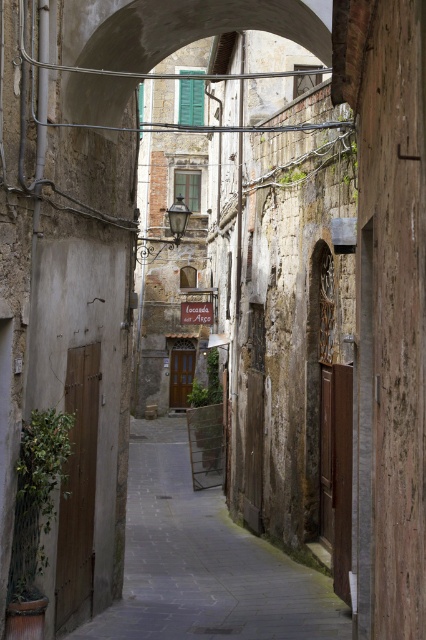
You are a tourist standing at the entrance of the historic alleyway. You want to walk through the alley to reach the wooden door at the end. There are two features here, the smooth stone path at center and the smooth stone arch at center. Which one should you step over first?

You should step over the smooth stone path at center first because the smooth stone arch at center is behind it, meaning the path comes before the arch along the walking route.

Consider the image. You are a tour guide leading a group through this historic alleyway. You want to ensure everyone can walk comfortably from the entrance to the smooth stone arch at center. The widest participant in your group is 0.6 meters wide. Is the smooth stone path at center wide enough for them to pass safely?

The smooth stone path at center is the path leading to the smooth stone arch at center. Since the distance between them is 6.94 meters, which is more than enough space for the participant who is 0.6 meters wide to pass safely.